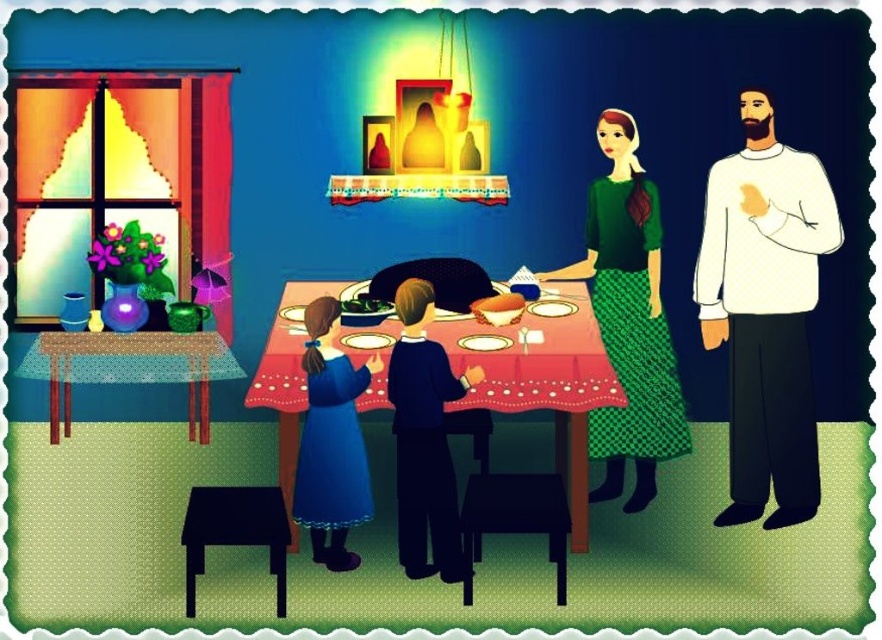
Question: Which of the following is the farthest from the observer?

Choices:
 (A) (420, 396)
 (B) (334, 532)

Answer: (B)

Question: Which point is closer to the camera?

Choices:
 (A) smooth red tablecloth at center
 (B) blue satin dress at lower left

Answer: (B)

Question: Can you confirm if blue satin dress at lower left is bigger than wooden table at left?

Choices:
 (A) no
 (B) yes

Answer: (A)

Question: Which object appears closest to the camera in this image?

Choices:
 (A) smooth red tablecloth at center
 (B) dark blue fabric at center
 (C) blue satin dress at lower left
 (D) green textured dress at center

Answer: (B)

Question: In this image, where is white matte sweater at right located relative to smooth red tablecloth at center?

Choices:
 (A) right
 (B) left

Answer: (A)

Question: Does dark blue fabric at center have a smaller size compared to green leafy vegetable at table?

Choices:
 (A) no
 (B) yes

Answer: (A)